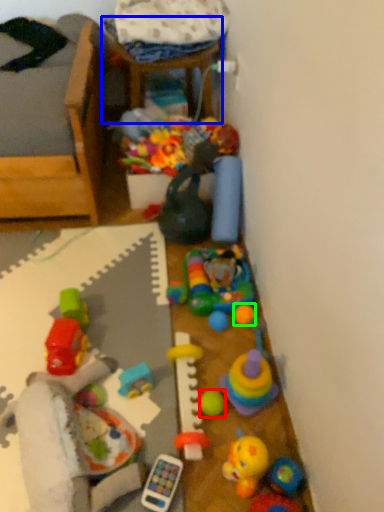
Question: Considering the real-world distances, which object is farthest from toy (highlighted by a red box)? furniture (highlighted by a blue box) or toy (highlighted by a green box)?

Choices:
 (A) furniture
 (B) toy

Answer: (A)